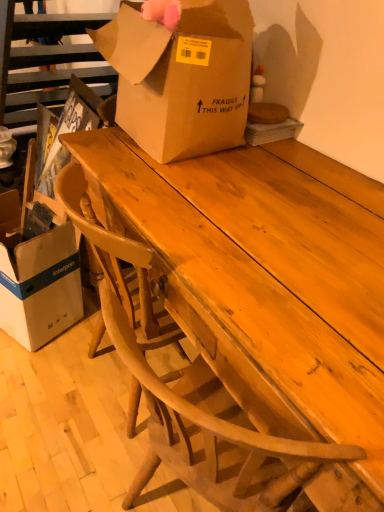
This screenshot has width=384, height=512. Describe the element at coordinates (41, 286) in the screenshot. I see `white cardboard box at lower left, which ranks as the first box in bottom-to-top order` at that location.

Describe the element at coordinates (182, 77) in the screenshot. I see `brown cardboard box at center, which ranks as the 2th box in left-to-right order` at that location.

At what (x,y) coordinates should I click in order to perform the action: click on white cardboard box at lower left, which ranks as the second box in top-to-bottom order. Please return your answer as a coordinate pair (x, y). This screenshot has height=512, width=384. Looking at the image, I should click on (41, 286).

Does white cardboard box at lower left, which ranks as the first box in bottom-to-top order, have a lesser height compared to brown cardboard box at center, placed as the first box when sorted from right to left?

In fact, white cardboard box at lower left, which ranks as the first box in bottom-to-top order, may be taller than brown cardboard box at center, placed as the first box when sorted from right to left.

From the image's perspective, is white cardboard box at lower left, marked as the 2th box in a right-to-left arrangement, under brown cardboard box at center, the first box from the top?

Yes, from the image's perspective, white cardboard box at lower left, marked as the 2th box in a right-to-left arrangement, is beneath brown cardboard box at center, the first box from the top.

Could you tell me if white cardboard box at lower left, marked as the 2th box in a right-to-left arrangement, is facing brown cardboard box at center, the first box from the top?

No, white cardboard box at lower left, marked as the 2th box in a right-to-left arrangement, is not oriented towards brown cardboard box at center, the first box from the top.

Locate an element on the screen. The height and width of the screenshot is (512, 384). box above the white cardboard box at lower left, marked as the 2th box in a right-to-left arrangement (from a real-world perspective) is located at coordinates (182, 77).

Is brown cardboard box at center, which ranks as the 2th box in left-to-right order, a part of wooden table at center?

No, brown cardboard box at center, which ranks as the 2th box in left-to-right order, is located outside of wooden table at center.

Which is more to the left, wooden table at center or brown cardboard box at center, the 2th box ordered from the bottom?

Positioned to the left is brown cardboard box at center, the 2th box ordered from the bottom.

Does wooden table at center come in front of brown cardboard box at center, the first box from the top?

Yes, wooden table at center is closer to the viewer.

From the image's perspective, is wooden table at center under brown cardboard box at center, which ranks as the 2th box in left-to-right order?

Yes.

In the scene shown: Can you see white cardboard box at lower left, which ranks as the second box in top-to-bottom order, touching wooden table at center?

There is a gap between white cardboard box at lower left, which ranks as the second box in top-to-bottom order, and wooden table at center.

How many degrees apart are the facing directions of white cardboard box at lower left, the first box positioned from the left, and wooden table at center?

white cardboard box at lower left, the first box positioned from the left, and wooden table at center are facing 20.9 degrees away from each other.

Considering the relative sizes of white cardboard box at lower left, which ranks as the second box in top-to-bottom order, and wooden table at center in the image provided, is white cardboard box at lower left, which ranks as the second box in top-to-bottom order, shorter than wooden table at center?

Indeed, white cardboard box at lower left, which ranks as the second box in top-to-bottom order, has a lesser height compared to wooden table at center.

Which point is more forward, (69,239) or (189,200)?

The point (189,200) is closer to the camera.

You are a GUI agent. You are given a task and a screenshot of the screen. Output one action in this format:
    pyautogui.click(x=<x>, y=<y>)
    Task: Click on the box above the white cardboard box at lower left, the first box positioned from the left (from the image's perspective)
    The height and width of the screenshot is (512, 384).
    Given the screenshot: What is the action you would take?
    (182, 77)

Which object is wider, brown cardboard box at center, the first box from the top, or white cardboard box at lower left, which ranks as the second box in top-to-bottom order?

Wider between the two is brown cardboard box at center, the first box from the top.

Is brown cardboard box at center, placed as the first box when sorted from right to left, positioned in front of white cardboard box at lower left, marked as the 2th box in a right-to-left arrangement?

Yes.

From a real-world perspective, is brown cardboard box at center, the 2th box ordered from the bottom, on white cardboard box at lower left, the first box positioned from the left?

Correct, in the physical world, brown cardboard box at center, the 2th box ordered from the bottom, is higher than white cardboard box at lower left, the first box positioned from the left.

What's the angular difference between wooden table at center and white cardboard box at lower left, the first box positioned from the left,'s facing directions?

wooden table at center and white cardboard box at lower left, the first box positioned from the left, are facing 20.9 degrees away from each other.

Considering the relative sizes of wooden table at center and white cardboard box at lower left, the first box positioned from the left, in the image provided, is wooden table at center wider than white cardboard box at lower left, the first box positioned from the left,?

Yes.

Is wooden table at center positioned in front of white cardboard box at lower left, which ranks as the second box in top-to-bottom order?

Yes, wooden table at center is in front of white cardboard box at lower left, which ranks as the second box in top-to-bottom order.

Locate an element on the screen. table above the white cardboard box at lower left, marked as the 2th box in a right-to-left arrangement (from a real-world perspective) is located at coordinates (267, 285).

Which point is more distant from viewer, [213,125] or [205,243]?

The point [213,125] is farther from the camera.

From a real-world perspective, is brown cardboard box at center, the first box from the top, under wooden table at center?

No, from a real-world perspective, brown cardboard box at center, the first box from the top, is not below wooden table at center.

Is brown cardboard box at center, the 2th box ordered from the bottom, not close to wooden table at center?

They are positioned close to each other.

From the image's perspective, is brown cardboard box at center, placed as the first box when sorted from right to left, located above wooden table at center?

Indeed, from the image's perspective, brown cardboard box at center, placed as the first box when sorted from right to left, is shown above wooden table at center.

Find the location of a particular element. box that is on the left side of brown cardboard box at center, which ranks as the 2th box in left-to-right order is located at coordinates (41, 286).

Identify the location of the 2nd box positioned above the wooden table at center (from the image's perspective). The height and width of the screenshot is (512, 384). (182, 77).

Based on their spatial positions, is white cardboard box at lower left, the first box positioned from the left, or brown cardboard box at center, which ranks as the 2th box in left-to-right order, further from wooden table at center?

white cardboard box at lower left, the first box positioned from the left.

Based on their spatial positions, is wooden table at center or brown cardboard box at center, the 2th box ordered from the bottom, further from white cardboard box at lower left, which ranks as the first box in bottom-to-top order?

The object further to white cardboard box at lower left, which ranks as the first box in bottom-to-top order, is wooden table at center.

Which object lies further to the anchor point brown cardboard box at center, placed as the first box when sorted from right to left, wooden table at center or white cardboard box at lower left, the first box positioned from the left?

The object further to brown cardboard box at center, placed as the first box when sorted from right to left, is white cardboard box at lower left, the first box positioned from the left.

Based on their spatial positions, is brown cardboard box at center, the first box from the top, or white cardboard box at lower left, which ranks as the first box in bottom-to-top order, further from wooden table at center?

white cardboard box at lower left, which ranks as the first box in bottom-to-top order, is positioned further to the anchor wooden table at center.

Considering their positions, is white cardboard box at lower left, which ranks as the second box in top-to-bottom order, positioned closer to brown cardboard box at center, which ranks as the 2th box in left-to-right order, than wooden table at center?

wooden table at center.

Estimate the real-world distances between objects in this image. Which object is further from white cardboard box at lower left, which ranks as the second box in top-to-bottom order, brown cardboard box at center, placed as the first box when sorted from right to left, or wooden table at center?

wooden table at center is further to white cardboard box at lower left, which ranks as the second box in top-to-bottom order.

Identify the location of box between white cardboard box at lower left, which ranks as the first box in bottom-to-top order, and wooden table at center, in the horizontal direction. This screenshot has height=512, width=384. (182, 77).